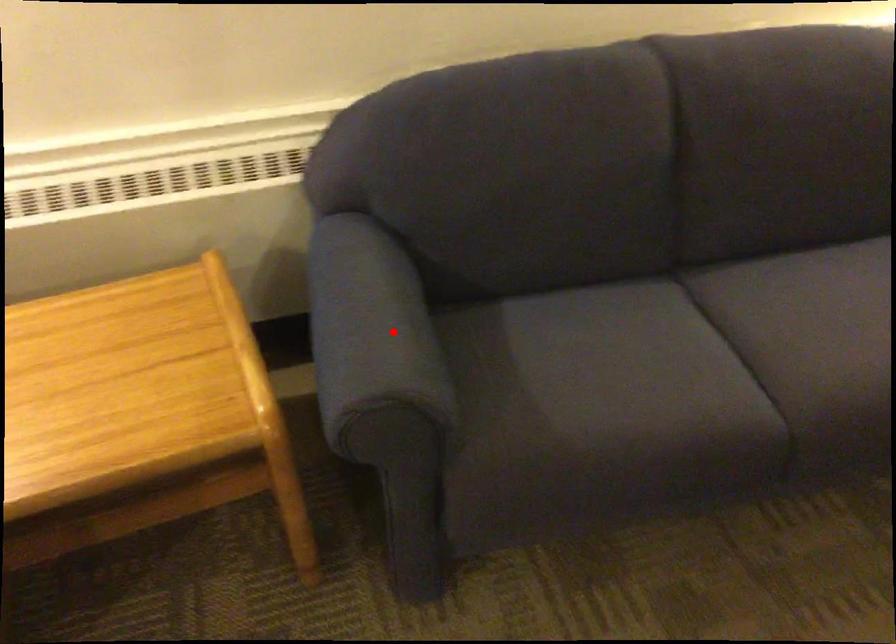
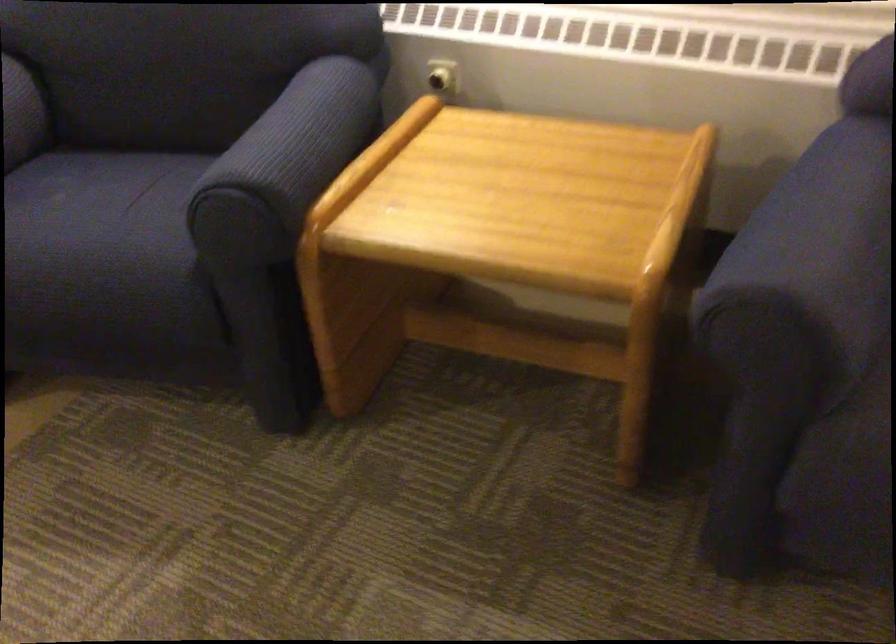
Question: A red point is marked in image1. In image2, is the corresponding 3D point closer to the camera or farther? Reply with the corresponding letter.

Choices:
 (A) The corresponding 3D point is closer.
 (B) The corresponding 3D point is farther.

Answer: (A)